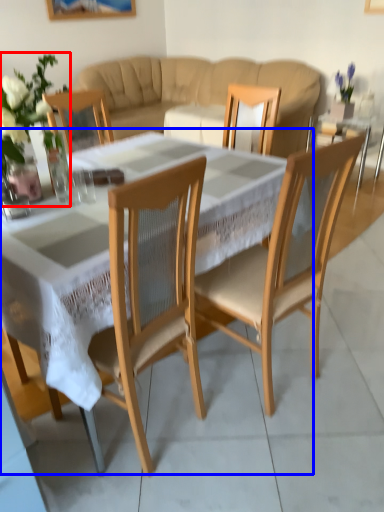
Question: Among these objects, which one is nearest to the camera, floral arrangement (highlighted by a red box) or coffee table (highlighted by a blue box)?

Choices:
 (A) floral arrangement
 (B) coffee table

Answer: (B)